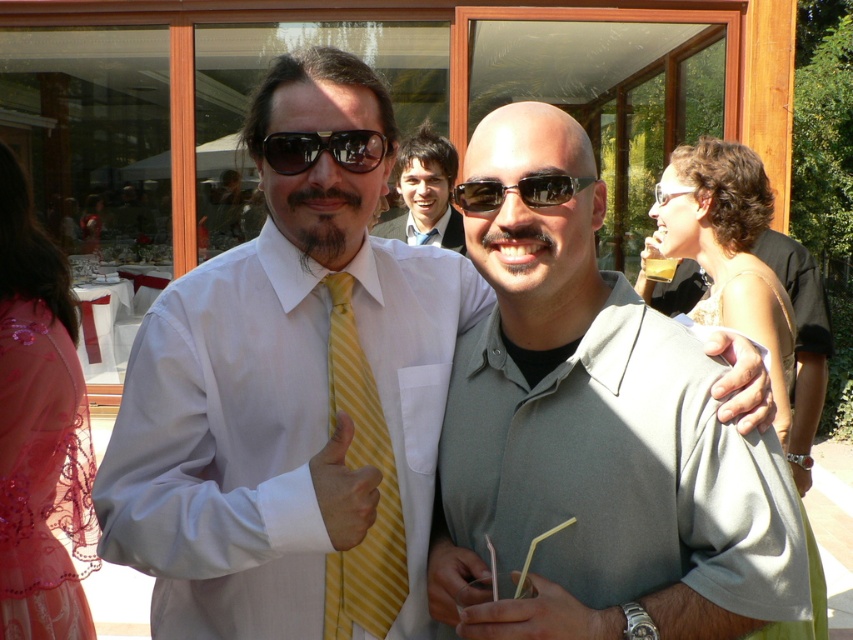
You are a photographer standing at the camera position. You want to take a closeup photo of the matte gray polo shirt at center. Can you reach it with your 1.5 meter long selfie stick?

The matte gray polo shirt at center is 1.47 meters away from camera. Since the selfie stick is 1.5 meters long, you can reach it.

You are standing at the origin point of the image coordinate system. You want to walk towards the point at [437,611]. However, there is an obstacle at point [561,195]. Will you encounter the obstacle before reaching your destination?

Yes, because point [561,195] is in front of point [437,611], so you will encounter the obstacle at point [561,195] before reaching your destination.